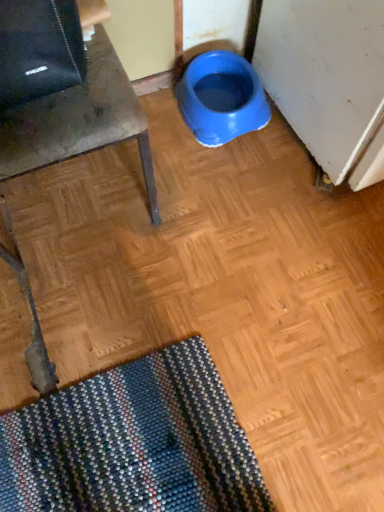
Question: Is matte gray chair at left wider or thinner than blue plastic bowl at center?

Choices:
 (A) wide
 (B) thin

Answer: (A)

Question: From a real-world perspective, is matte gray chair at left positioned above or below blue plastic bowl at center?

Choices:
 (A) below
 (B) above

Answer: (B)

Question: In terms of size, does matte gray chair at left appear bigger or smaller than blue plastic bowl at center?

Choices:
 (A) small
 (B) big

Answer: (B)

Question: Considering the positions of blue plastic bowl at center and matte gray chair at left in the image, is blue plastic bowl at center bigger or smaller than matte gray chair at left?

Choices:
 (A) small
 (B) big

Answer: (A)

Question: From the image's perspective, is blue plastic bowl at center located above or below matte gray chair at left?

Choices:
 (A) above
 (B) below

Answer: (A)

Question: Looking at their shapes, would you say blue plastic bowl at center is wider or thinner than matte gray chair at left?

Choices:
 (A) wide
 (B) thin

Answer: (B)

Question: Considering the positions of blue plastic bowl at center and matte gray chair at left in the image, is blue plastic bowl at center taller or shorter than matte gray chair at left?

Choices:
 (A) short
 (B) tall

Answer: (A)